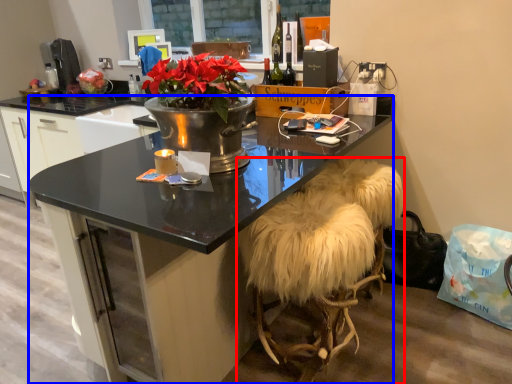
Question: Which object appears closest to the camera in this image, stool (highlighted by a red box) or desk (highlighted by a blue box)?

Choices:
 (A) stool
 (B) desk

Answer: (B)